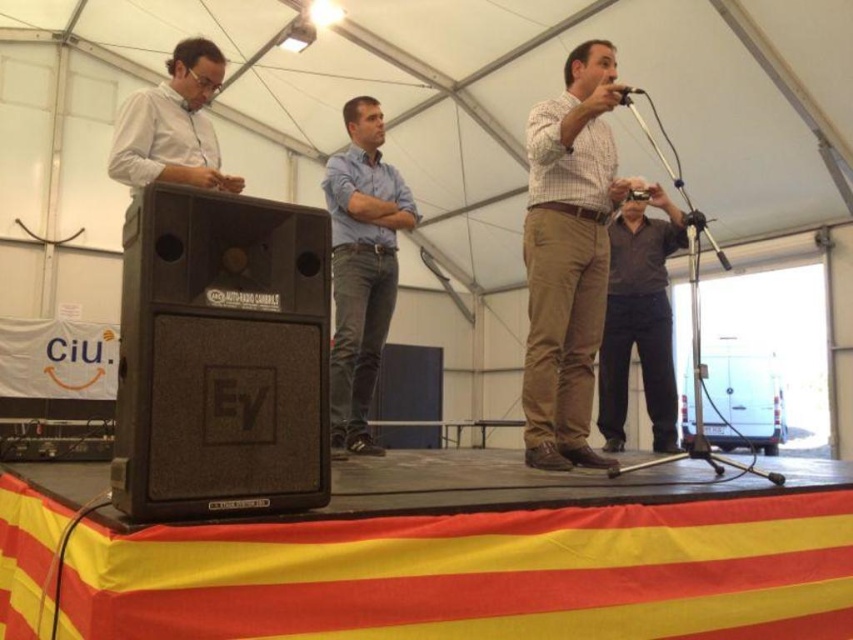
Based on the photo, you are a photographer at the event and want to capture a clear shot of both the plaid cotton shirt at center and the blue denim jeans at center. Since you can only focus on one subject at a time, which one should you focus on to ensure the other is still somewhat in the background?

You should focus on the plaid cotton shirt at center because it is in front of the blue denim jeans at center, so focusing on it will keep the blue denim jeans at center in the background.

You are a stagehand setting up for a performance. You need to ensure that the black matte speaker at left is placed to the left of the blue denim jeans at center. Based on the scene description, is the current arrangement correct?

The black matte speaker at left is positioned on the left side of blue denim jeans at center, so the current arrangement is correct.

You are a stagehand setting up for a performance. You need to ensure that all equipment is taller than the performers to avoid blocking the audience view. The black matte speaker at left and blue denim jeans at center are both in your line of sight. Which of these two items is shorter and might need adjustment?

The black matte speaker at left is shorter than the blue denim jeans at center, so it might need adjustment to ensure it is taller than the performers.